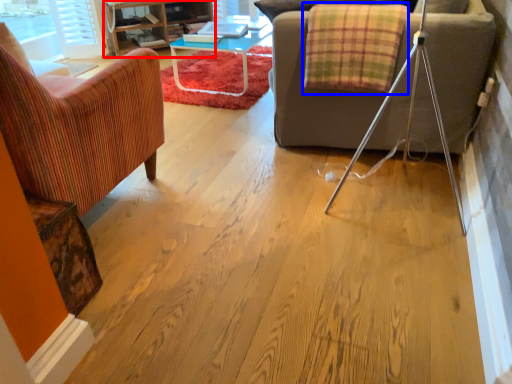
Question: Which object appears farthest to the camera in this image, entertainment center (highlighted by a red box) or blanket (highlighted by a blue box)?

Choices:
 (A) entertainment center
 (B) blanket

Answer: (A)